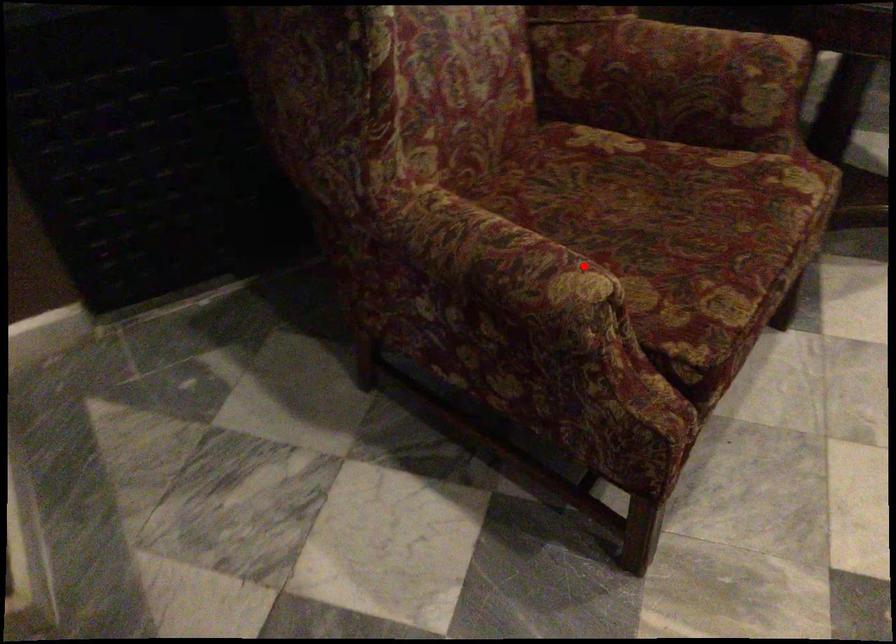
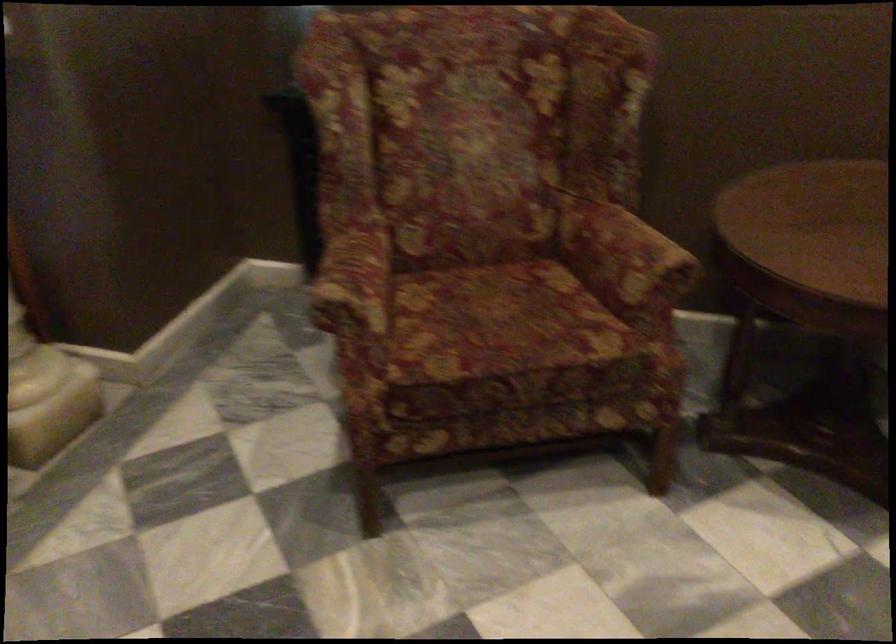
Question: I am providing you with two images of the same scene from different viewpoints. In image1, a red point is highlighted. Considering the same 3D point in image2, which of the following is correct?

Choices:
 (A) It is closer
 (B) It is farther

Answer: (B)